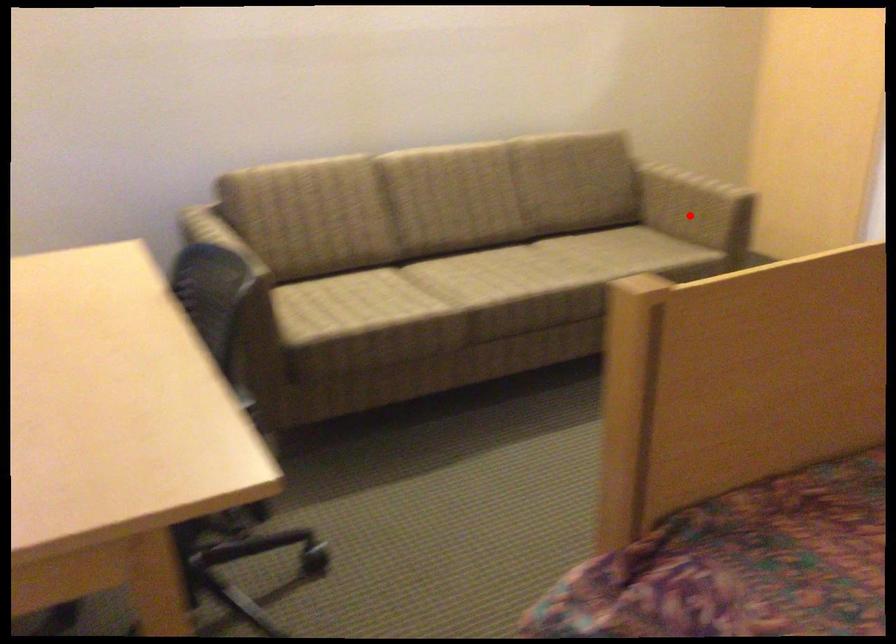
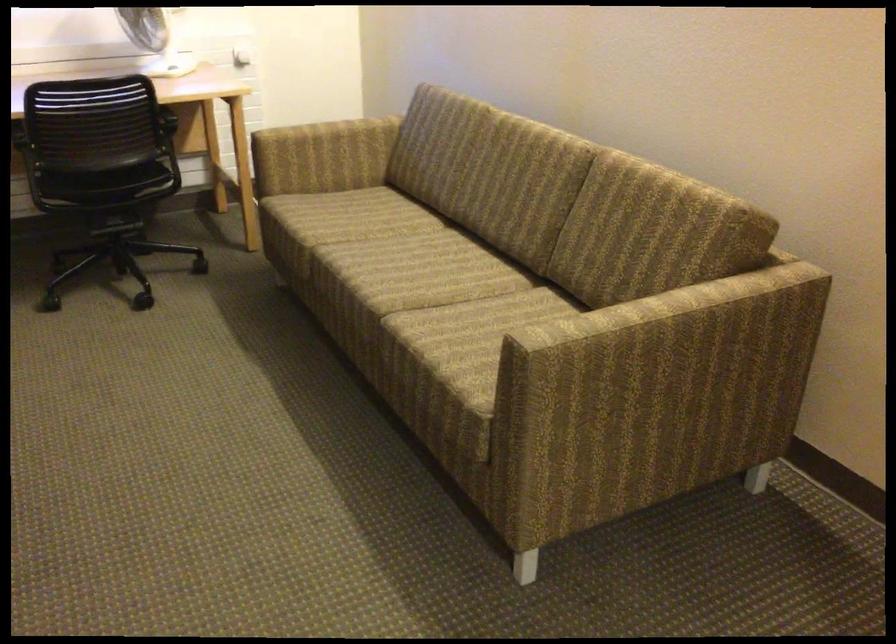
The point at the highlighted location is marked in the first image. Where is the corresponding point in the second image?

(655, 393)